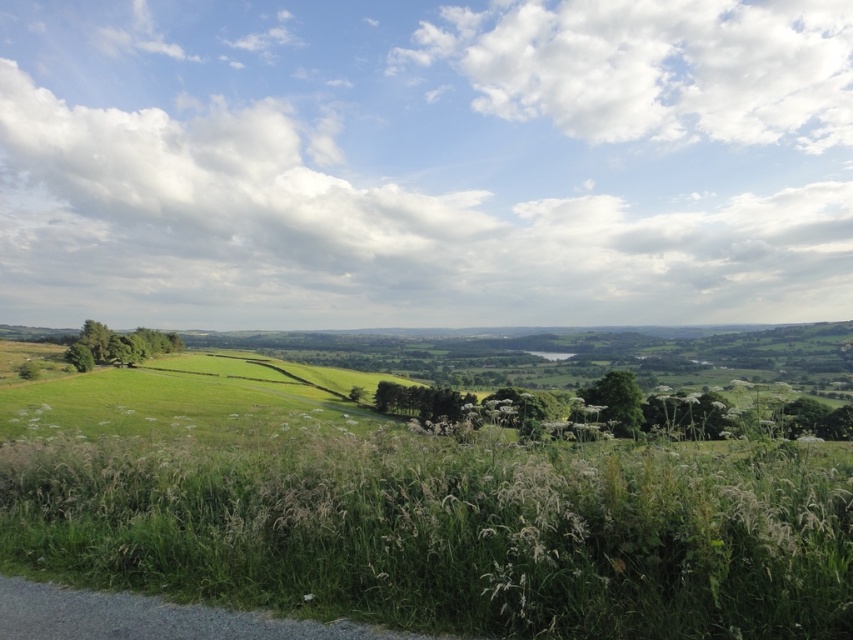
Question: Can you confirm if green grassy at lower center is wider than green grassy field at lower left?

Choices:
 (A) no
 (B) yes

Answer: (A)

Question: Which point is closer to the camera?

Choices:
 (A) (781, 444)
 (B) (271, 408)

Answer: (A)

Question: Does green grassy at lower center have a lesser width compared to green grassy field at lower left?

Choices:
 (A) no
 (B) yes

Answer: (B)

Question: Among these objects, which one is nearest to the camera?

Choices:
 (A) green grassy at lower center
 (B) green grassy field at lower left

Answer: (A)

Question: Which of the following is the closest to the observer?

Choices:
 (A) (241, 369)
 (B) (206, 572)

Answer: (B)

Question: Is green grassy at lower center thinner than green grassy field at lower left?

Choices:
 (A) no
 (B) yes

Answer: (B)